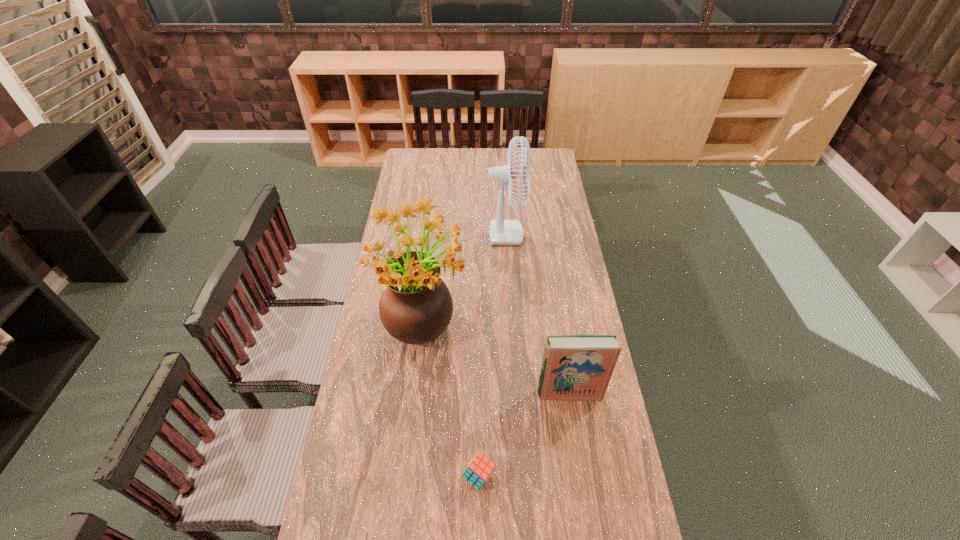
Find the location of a particular element. The height and width of the screenshot is (540, 960). the farthest object is located at coordinates (501, 232).

The height and width of the screenshot is (540, 960). Find the location of `flower arrangement`. flower arrangement is located at coordinates (415, 307).

Image resolution: width=960 pixels, height=540 pixels. In order to click on the third farthest object in this screenshot , I will do `click(575, 367)`.

Where is `hardback book`? The width and height of the screenshot is (960, 540). hardback book is located at coordinates tap(575, 367).

Locate an element on the screen. Image resolution: width=960 pixels, height=540 pixels. cube is located at coordinates (480, 468).

Find the location of a particular element. the shortest object is located at coordinates (480, 468).

The image size is (960, 540). Identify the location of vacant space situated on the front-facing side of the farthest object. (545, 224).

The width and height of the screenshot is (960, 540). What are the coordinates of `vacant area situated on the back of the flower arrangement` in the screenshot? It's located at (432, 266).

The height and width of the screenshot is (540, 960). Identify the location of vacant position located on the cover of the third farthest object. (583, 482).

Locate an element on the screen. Image resolution: width=960 pixels, height=540 pixels. vacant space located 0.380m on the right of the cube is located at coordinates (625, 476).